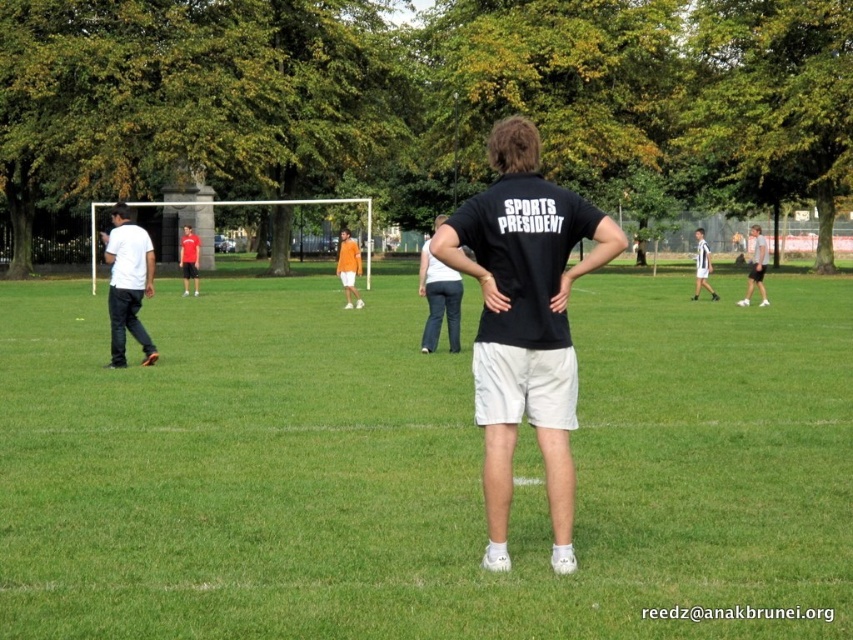
Does orange fabric shorts at center have a smaller size compared to white jersey at center?

Yes, orange fabric shorts at center is smaller than white jersey at center.

Who is higher up, orange fabric shorts at center or white jersey at center?

orange fabric shorts at center

What do you see at coordinates (347, 268) in the screenshot?
I see `orange fabric shorts at center` at bounding box center [347, 268].

Where is `orange fabric shorts at center`? The width and height of the screenshot is (853, 640). orange fabric shorts at center is located at coordinates (347, 268).

Is white matte shirt at left to the left of white jersey at center from the viewer's perspective?

Yes, white matte shirt at left is to the left of white jersey at center.

Is white matte shirt at left below white jersey at center?

Yes.

What are the coordinates of `white matte shirt at left` in the screenshot? It's located at (128, 284).

Measure the distance between point [178,253] and camera.

55.58 meters

Can you confirm if matte red shirt at center is shorter than white jersey at center?

Correct, matte red shirt at center is not as tall as white jersey at center.

You are a GUI agent. You are given a task and a screenshot of the screen. Output one action in this format:
    pyautogui.click(x=<x>, y=<y>)
    Task: Click on the matte red shirt at center
    The image size is (853, 640).
    Given the screenshot: What is the action you would take?
    pyautogui.click(x=189, y=259)

At what (x,y) coordinates should I click in order to perform the action: click on matte red shirt at center. Please return your answer as a coordinate pair (x, y). Looking at the image, I should click on (189, 259).